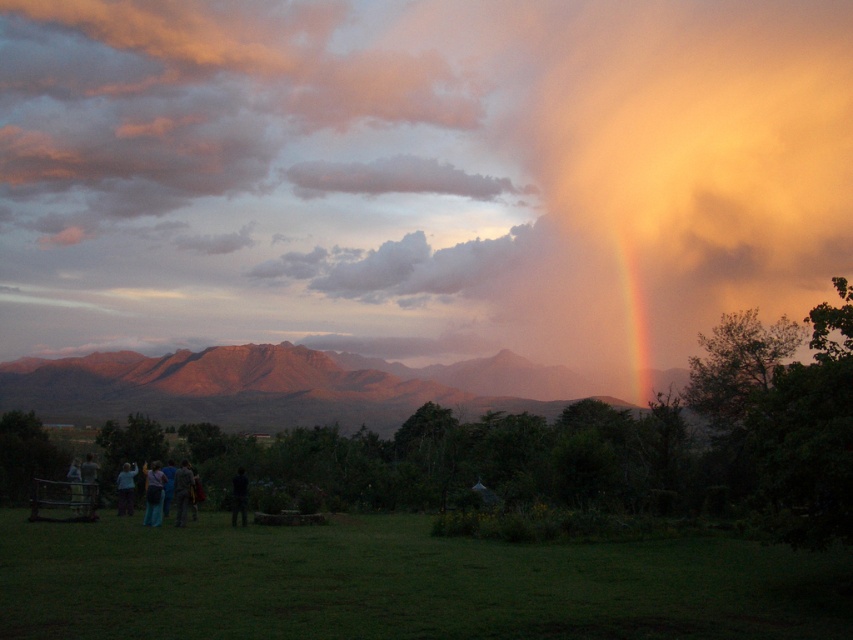
Between point (473, 195) and point (178, 508), which one is positioned behind?

The point (473, 195) is behind.

Does gray fluffy cloud at upper center have a lesser width compared to camouflage fabric jacket at lower left?

In fact, gray fluffy cloud at upper center might be wider than camouflage fabric jacket at lower left.

Who is more distant from viewer, (376, 179) or (175, 484)?

Point (376, 179)

Locate an element on the screen. The image size is (853, 640). gray fluffy cloud at upper center is located at coordinates (396, 179).

Is point (457, 372) positioned behind point (88, 500)?

Yes, point (457, 372) is behind point (88, 500).

Does rustic brown mountains at center appear on the right side of dark blue jeans at lower left?

In fact, rustic brown mountains at center is to the left of dark blue jeans at lower left.

The height and width of the screenshot is (640, 853). Identify the location of rustic brown mountains at center. (259, 387).

Can you confirm if rainbow at upper center is positioned to the right of camouflage fabric jacket at lower left?

Indeed, rainbow at upper center is positioned on the right side of camouflage fabric jacket at lower left.

Does point (364, 140) lie behind point (184, 493)?

That is True.

This screenshot has height=640, width=853. I want to click on rainbow at upper center, so click(x=421, y=156).